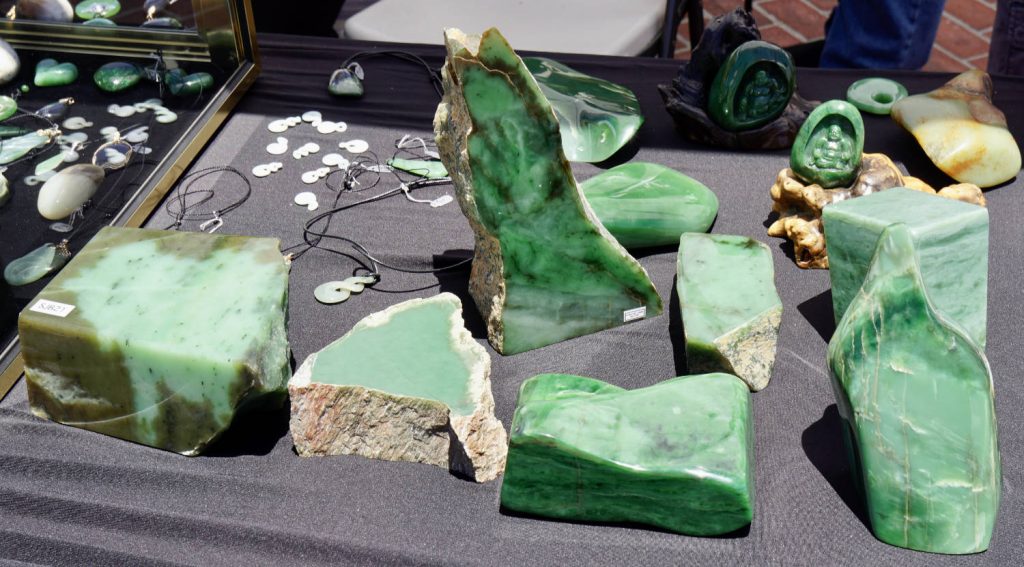
You are a GUI agent. You are given a task and a screenshot of the screen. Output one action in this format:
    pyautogui.click(x=<x>, y=<y>)
    Task: Click on the pendants
    This screenshot has width=1024, height=567.
    Given the screenshot: What is the action you would take?
    pyautogui.click(x=355, y=142), pyautogui.click(x=334, y=150), pyautogui.click(x=312, y=163), pyautogui.click(x=298, y=193), pyautogui.click(x=267, y=168), pyautogui.click(x=298, y=148), pyautogui.click(x=319, y=121), pyautogui.click(x=289, y=113), pyautogui.click(x=337, y=286)